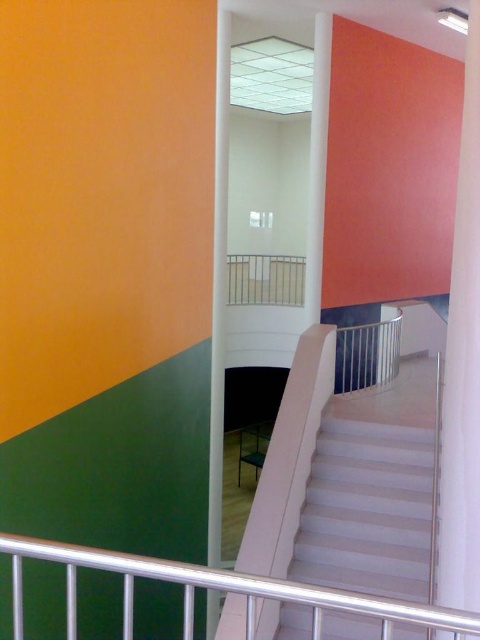
You are standing in the modern interior space and notice two white glossy structures at the center. Which one is closer to you, the white glossy pillar at center or the white glossy column at center?

The white glossy pillar at center is closer to you as it is positioned in front of the white glossy column at center.

You are an interior designer assessing the space. You need to install a shelf that requires a support structure. Which object between the white glossy pillar at center and the white glossy column at center would be more suitable for this purpose based on their height?

The white glossy column at center is taller than the white glossy pillar at center, making it more suitable for supporting a shelf due to its greater height.

You are standing in the modern interior space and want to determine which of the two points, point (440, 570) or point (189, 604), is closer to you. Based on the scene description, which point is nearer to your current position?

Point (189, 604) is closer to you because it is less further to the camera than point (440, 570).